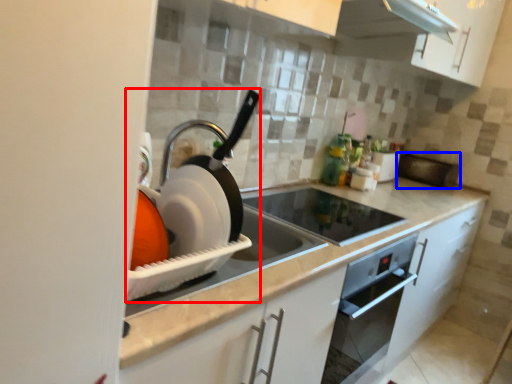
Question: Which of the following is the closest to the observer, appliance (highlighted by a red box) or appliance (highlighted by a blue box)?

Choices:
 (A) appliance
 (B) appliance

Answer: (A)